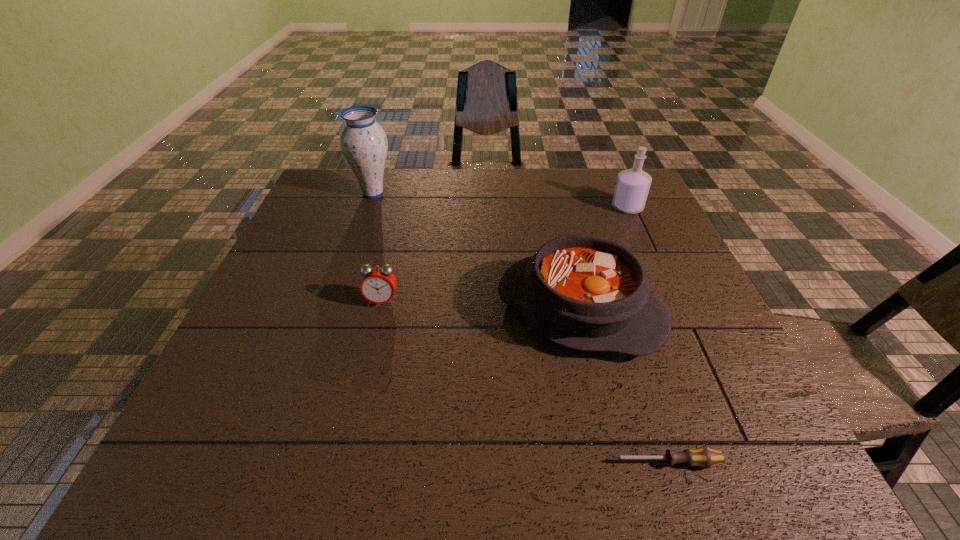
I want to click on the leftmost object, so click(x=363, y=142).

At what (x,y) coordinates should I click in order to perform the action: click on vase. Please return your answer as a coordinate pair (x, y). Looking at the image, I should click on (363, 142).

At what (x,y) coordinates should I click in order to perform the action: click on the fourth shortest object. Please return your answer as a coordinate pair (x, y). The image size is (960, 540). Looking at the image, I should click on (632, 187).

Where is `the third tallest object`? the third tallest object is located at coordinates (584, 292).

Where is `alarm clock`? The height and width of the screenshot is (540, 960). alarm clock is located at coordinates (379, 284).

Identify the location of the second shortest object. This screenshot has height=540, width=960. (379, 284).

Where is `the nearest object`? This screenshot has width=960, height=540. the nearest object is located at coordinates (704, 457).

At what (x,y) coordinates should I click in order to perform the action: click on the shortest object. Please return your answer as a coordinate pair (x, y). This screenshot has height=540, width=960. Looking at the image, I should click on (704, 457).

Where is `vacant space located on the front of the tallest object`? The image size is (960, 540). vacant space located on the front of the tallest object is located at coordinates (351, 259).

The image size is (960, 540). I want to click on free point located 0.310m on the left of the perfume, so click(508, 207).